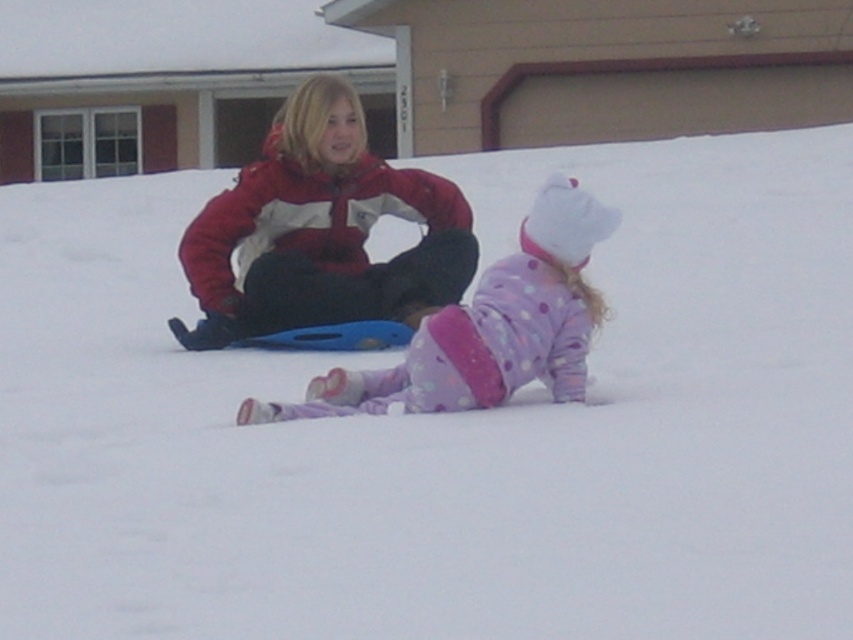
You are standing at the entrance of the house and want to find the red jacket at center. According to the coordinates provided, in which direction should you walk to reach it?

The red jacket at center is located at coordinates point [320,230]. Since the coordinate system is not specified, it is impossible to determine the exact direction to walk to reach the red jacket at center.